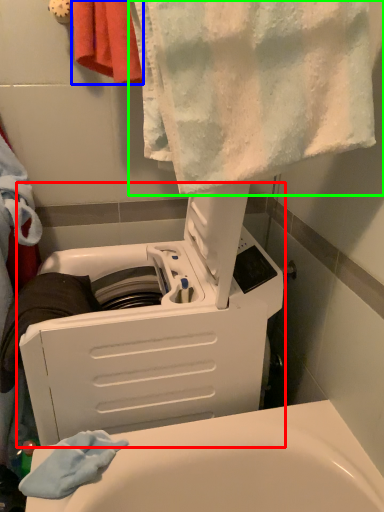
Question: Which object is positioned closest to appliance (highlighted by a red box)? Select from towel (highlighted by a blue box) and towel (highlighted by a green box).

Choices:
 (A) towel
 (B) towel

Answer: (B)